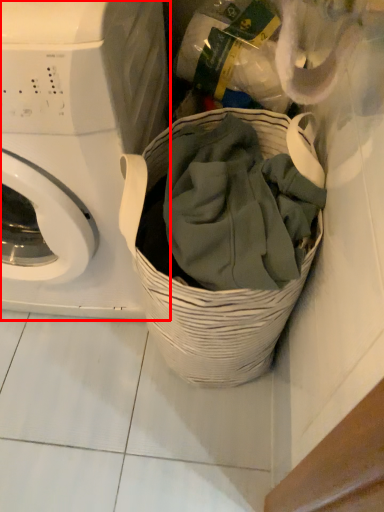
Question: Considering the relative positions of washing machine (annotated by the red box) and basket in the image provided, where is washing machine (annotated by the red box) located with respect to the staircase?

Choices:
 (A) right
 (B) left

Answer: (B)